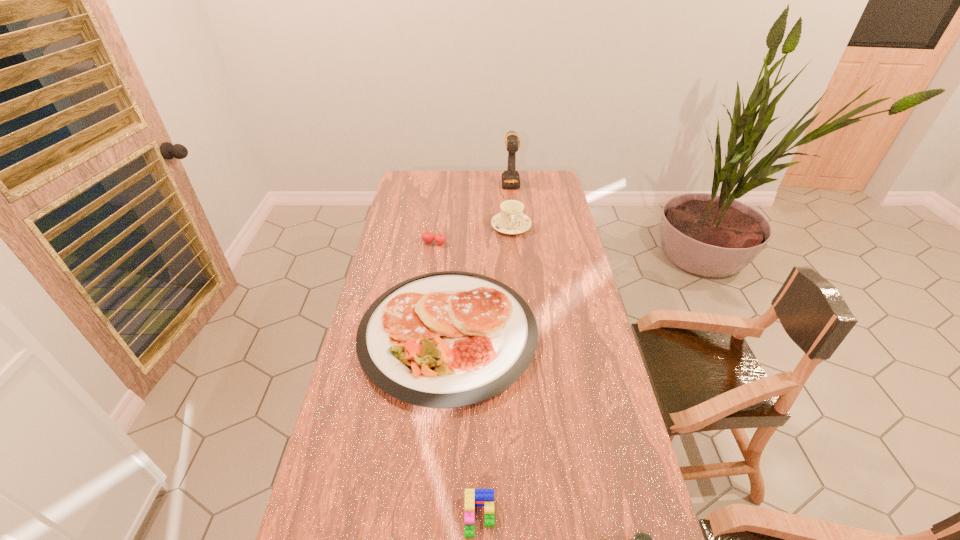
Locate an element on the screen. The height and width of the screenshot is (540, 960). vacant region located 0.210m on the left of the fifth tallest object is located at coordinates (376, 517).

This screenshot has width=960, height=540. Find the location of `object positioned at the far edge`. object positioned at the far edge is located at coordinates pyautogui.click(x=510, y=177).

Where is `cherry positioned at the left edge`? cherry positioned at the left edge is located at coordinates (428, 237).

Identify the location of dish positioned at the left edge. Image resolution: width=960 pixels, height=540 pixels. (449, 339).

The height and width of the screenshot is (540, 960). Find the location of `vacant space at the far edge of the desktop`. vacant space at the far edge of the desktop is located at coordinates (461, 183).

Where is `vacant region at the right edge of the desktop`? vacant region at the right edge of the desktop is located at coordinates (594, 328).

This screenshot has width=960, height=540. Identify the location of free space at the far left corner of the desktop. (411, 173).

In order to click on vacant region at the far right corner of the desktop in this screenshot , I will do `click(540, 174)`.

The width and height of the screenshot is (960, 540). In order to click on free space between the farthest object and the cherry in this screenshot , I will do 472,212.

At what (x,y) coordinates should I click in order to perform the action: click on vacant region between the drill and the cherry. Please return your answer as a coordinate pair (x, y). Looking at the image, I should click on (472, 212).